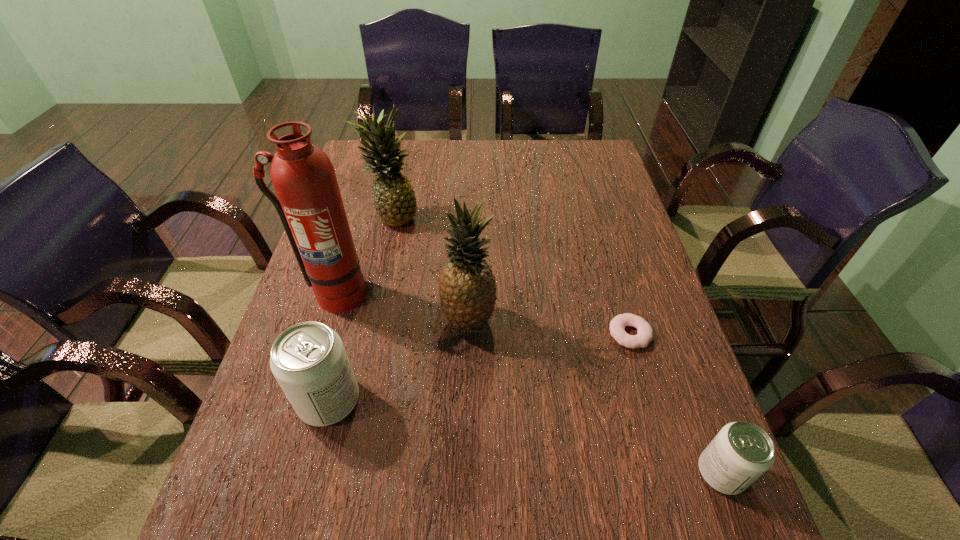
Please determine a free point for an extra pop_(soda) to ensure balance. Please provide its 2D coordinates. Your answer should be formatted as a tuple, i.e. [(x, y)], where the tuple contains the x and y coordinates of a point satisfying the conditions above.

[(514, 435)]